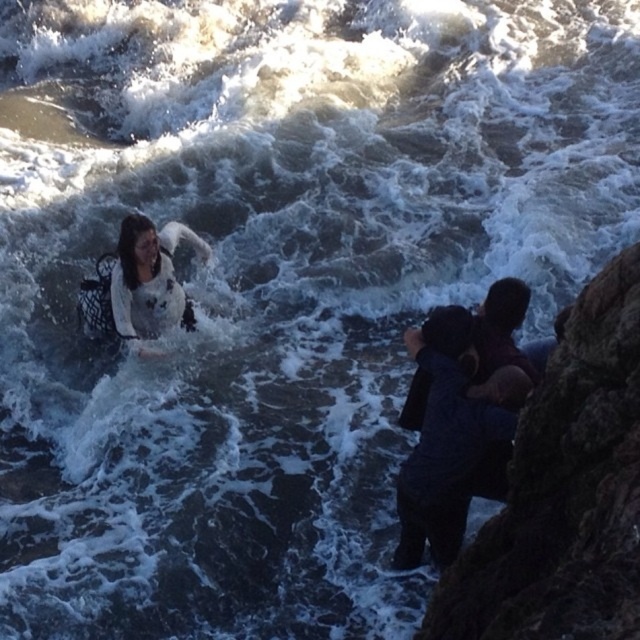
Does green mossy rock at right have a lesser width compared to white matte dress at lower left?

In fact, green mossy rock at right might be wider than white matte dress at lower left.

Does point (579, 304) come farther from viewer compared to point (109, 280)?

No, (579, 304) is closer to viewer.

You are a GUI agent. You are given a task and a screenshot of the screen. Output one action in this format:
    pyautogui.click(x=<x>, y=<y>)
    Task: Click on the green mossy rock at right
    The image size is (640, 640).
    Given the screenshot: What is the action you would take?
    pyautogui.click(x=564, y=492)

Can you confirm if dark blue fabric at right is wider than white matte dress at lower left?

No, dark blue fabric at right is not wider than white matte dress at lower left.

You are a GUI agent. You are given a task and a screenshot of the screen. Output one action in this format:
    pyautogui.click(x=<x>, y=<y>)
    Task: Click on the dark blue fabric at right
    This screenshot has width=640, height=640.
    Given the screenshot: What is the action you would take?
    pyautogui.click(x=449, y=435)

Is green mossy rock at right positioned in front of dark blue fabric at right?

Yes, it is.

Between green mossy rock at right and dark blue fabric at right, which one has more height?

Standing taller between the two is green mossy rock at right.

Locate an element on the screen. The image size is (640, 640). green mossy rock at right is located at coordinates (564, 492).